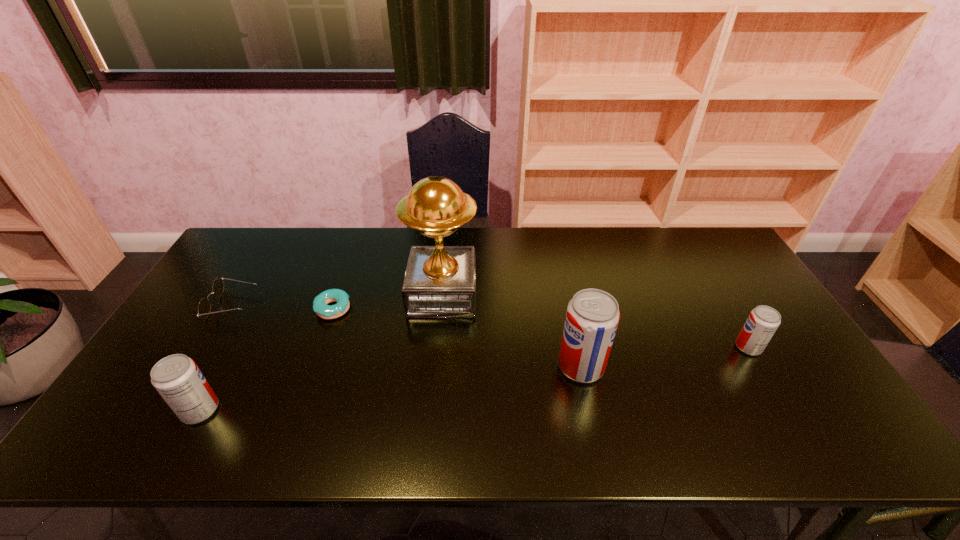
Locate an element on the screen. free space for an extra pop_(soda) to achieve even spacing is located at coordinates (399, 387).